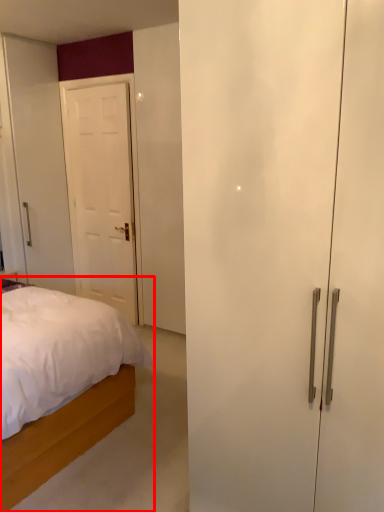
Question: Observing the image, what is the correct spatial positioning of bed (annotated by the red box) in reference to door?

Choices:
 (A) right
 (B) left

Answer: (B)